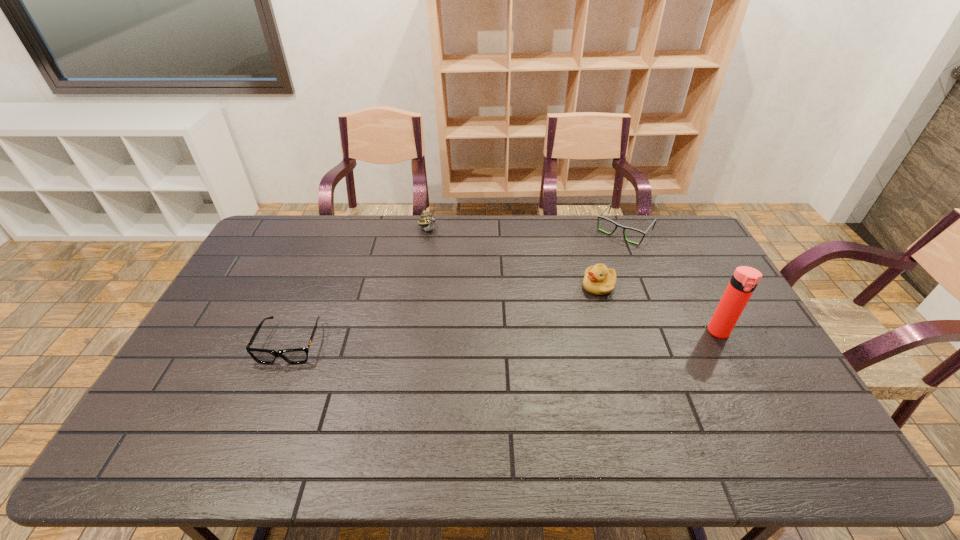
Find the location of a particular element. This screenshot has width=960, height=540. sunglasses is located at coordinates (297, 355).

Identify the location of the rightmost object. The image size is (960, 540). (745, 279).

At what (x,y) coordinates should I click in order to perform the action: click on the tallest object. Please return your answer as a coordinate pair (x, y). Image resolution: width=960 pixels, height=540 pixels. Looking at the image, I should click on (745, 279).

Locate an element on the screen. This screenshot has height=540, width=960. duckling is located at coordinates (599, 280).

Locate an element on the screen. the third farthest object is located at coordinates (599, 280).

Where is `the fourth shortest object`? the fourth shortest object is located at coordinates (427, 221).

Locate an element on the screen. This screenshot has width=960, height=540. the second object from left to right is located at coordinates (427, 221).

Where is `spectacles`? spectacles is located at coordinates (654, 222).

You are a GUI agent. You are given a task and a screenshot of the screen. Output one action in this format:
    pyautogui.click(x=<x>, y=<y>)
    Task: Click on the vacant space located on the front-facing side of the sunglasses
    The width and height of the screenshot is (960, 540).
    Given the screenshot: What is the action you would take?
    pyautogui.click(x=264, y=408)

Identify the location of free space located on the left of the rightmost object. The height and width of the screenshot is (540, 960). (652, 332).